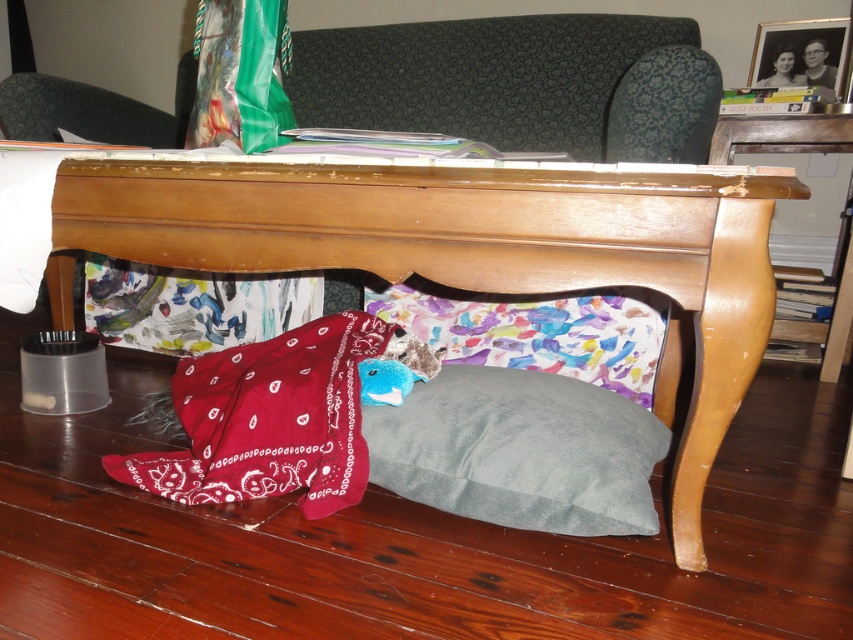
Who is higher up, red bandana at lower center or glossy wood side table at lower right?

glossy wood side table at lower right is above.

Is red bandana at lower center closer to camera compared to glossy wood side table at lower right?

That is True.

Who is more forward, (234, 388) or (846, 148)?

Point (234, 388) is in front.

This screenshot has width=853, height=640. I want to click on red bandana at lower center, so click(x=270, y=419).

This screenshot has height=640, width=853. What do you see at coordinates (467, 248) in the screenshot?
I see `wooden table at lower center` at bounding box center [467, 248].

Locate an element on the screen. The image size is (853, 640). wooden table at lower center is located at coordinates (467, 248).

The height and width of the screenshot is (640, 853). What do you see at coordinates (467, 248) in the screenshot?
I see `wooden table at lower center` at bounding box center [467, 248].

Image resolution: width=853 pixels, height=640 pixels. In order to click on wooden table at lower center in this screenshot , I will do `click(467, 248)`.

In the scene shown: Does red bandana at lower center have a lesser height compared to watercolor fabric pillow at under table?

Incorrect, red bandana at lower center's height does not fall short of watercolor fabric pillow at under table's.

Measure the distance between red bandana at lower center and camera.

red bandana at lower center is 3.47 feet from camera.

Identify the location of red bandana at lower center. (270, 419).